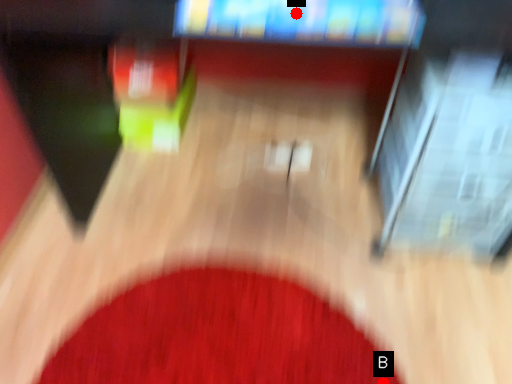
Question: Two points are circled on the image, labeled by A and B beside each circle. Which point appears farthest from the camera in this image?

Choices:
 (A) A is further
 (B) B is further

Answer: (B)